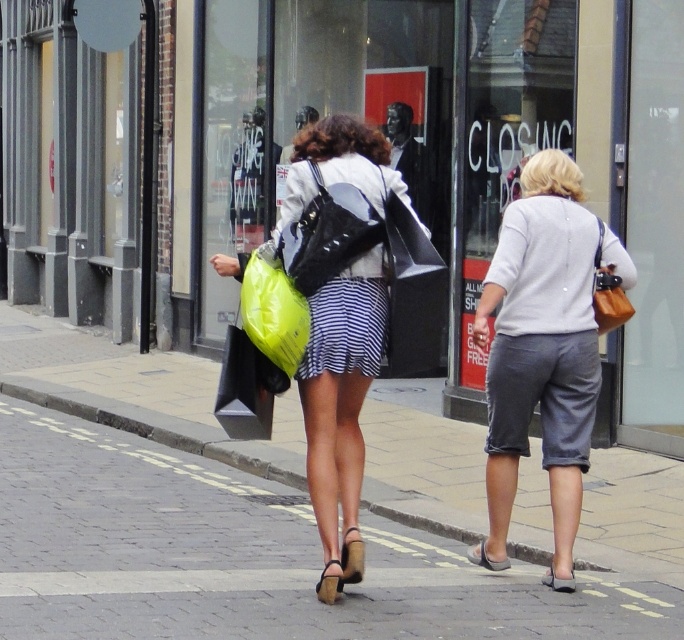
You are a window cleaner standing on the sidewalk. You need to clean the matte black sign at center and the gray cotton shorts at center. Which object is taller so you know where to start first?

The matte black sign at center is taller than the gray cotton shorts at center, so you should start cleaning the matte black sign at center first.

What is located at the point with coordinates (x=542, y=349)?

The gray cotton shorts at center are located at the point with coordinates (x=542, y=349).